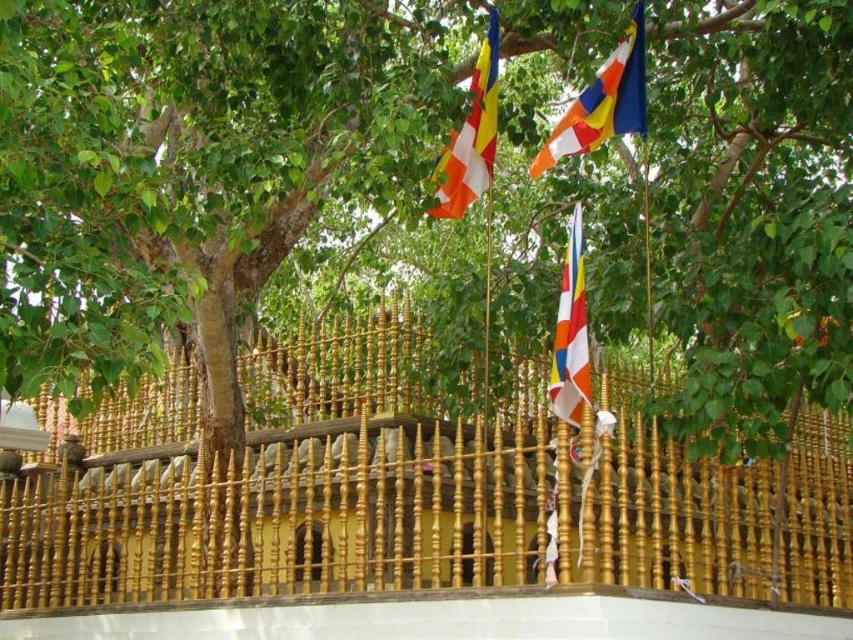
You are a photographer standing at the base of the Bodhi tree in the scene. You want to capture the orange and white striped flag at upper center in your shot. Given that your camera has a maximum focus range of 50 meters, will you be able to focus on the flag?

The orange and white striped flag at upper center is 45.38 meters away from the camera. Since the maximum focus range is 50 meters, the camera can focus on the flag as it is within range.

You are a visitor at this sacred site and want to place a small offering between the gold polished fence at center and the striped fabric flag at center. How far apart are these two objects?

The gold polished fence at center and striped fabric flag at center are 17.73 meters apart from each other.